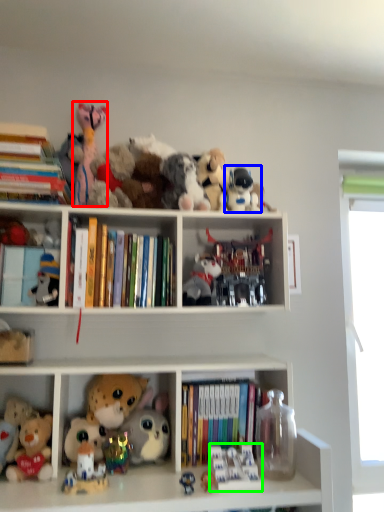
Question: Which object is the farthest from toy (highlighted by a red box)? Choose among these: toy (highlighted by a blue box) or toy (highlighted by a green box).

Choices:
 (A) toy
 (B) toy

Answer: (B)